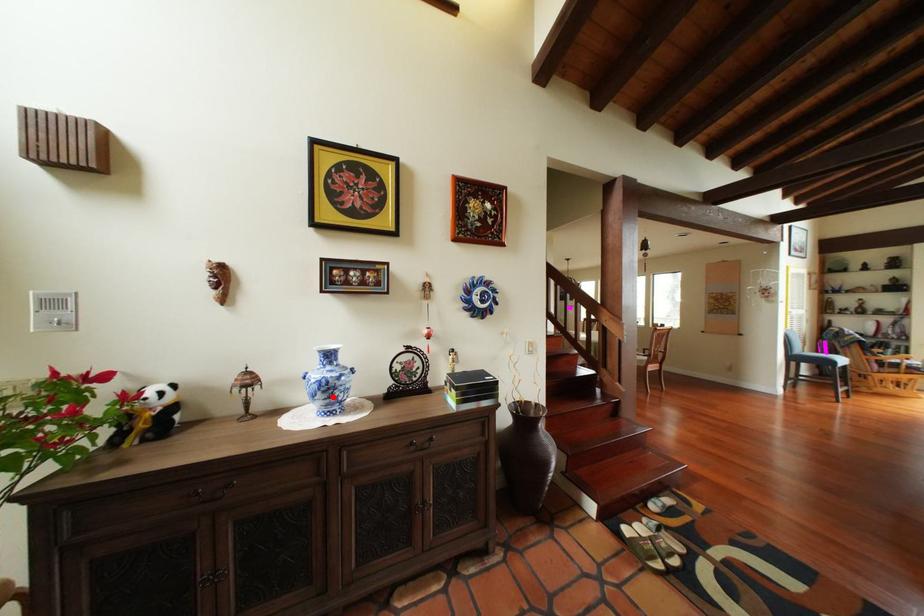
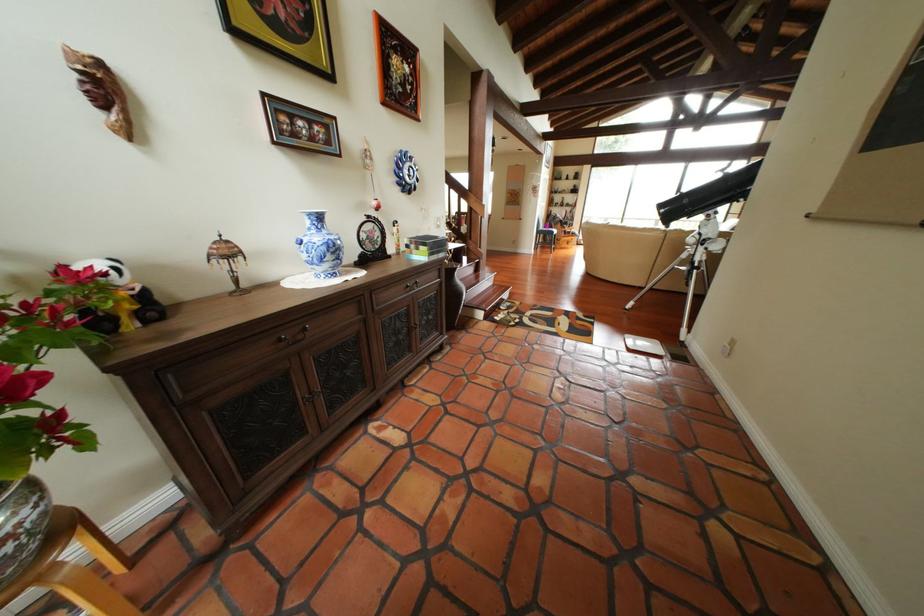
Locate, in the second image, the point that corresponds to the highlighted location in the first image.

(342, 257)